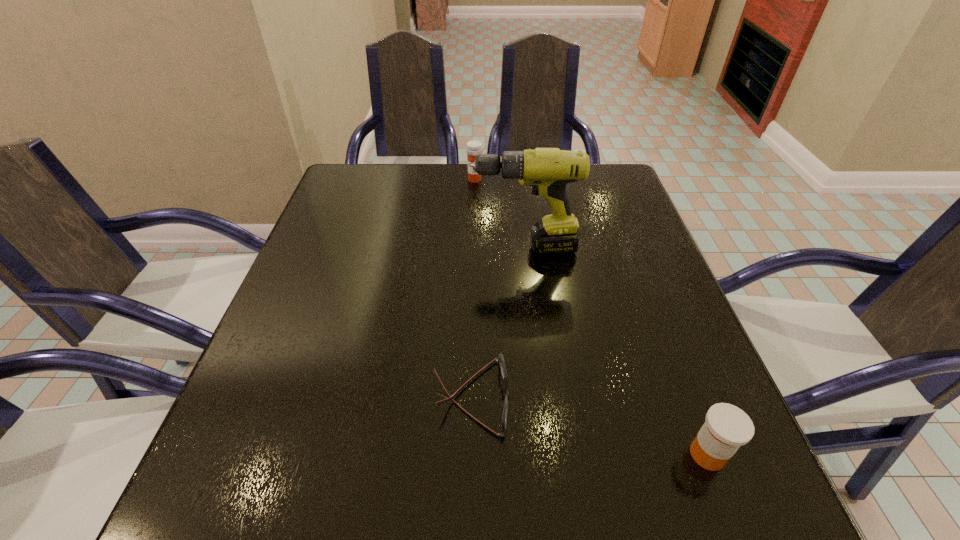
I want to click on vacant space located on the label side of the farther medicine, so 474,217.

I want to click on vacant space located on the label of the rightmost object, so click(x=732, y=519).

The width and height of the screenshot is (960, 540). Find the location of `vacant area located on the front-facing side of the spectacles`. vacant area located on the front-facing side of the spectacles is located at coordinates (599, 397).

At what (x,y) coordinates should I click in order to perform the action: click on object that is at the far edge. Please return your answer as a coordinate pair (x, y). Looking at the image, I should click on (474, 148).

This screenshot has width=960, height=540. I want to click on object positioned at the near edge, so click(x=727, y=427).

Locate an element on the screen. object located in the right edge section of the desktop is located at coordinates (727, 427).

Locate an element on the screen. object situated at the near right corner is located at coordinates (727, 427).

Identify the location of vacant area at the far edge. Image resolution: width=960 pixels, height=540 pixels. (498, 191).

Where is `vacant region at the left edge of the desktop`? The width and height of the screenshot is (960, 540). vacant region at the left edge of the desktop is located at coordinates (290, 345).

The width and height of the screenshot is (960, 540). In the image, there is a desktop. In order to click on vacant space at the right edge in this screenshot , I will do `click(592, 251)`.